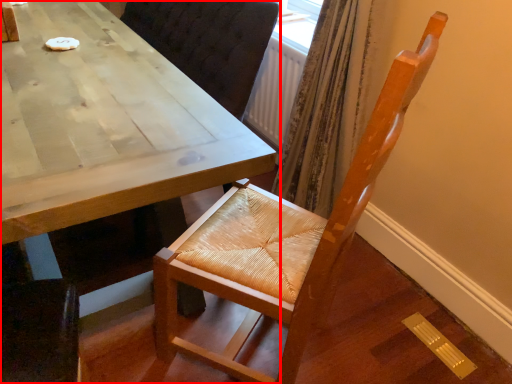
Question: From the image's perspective, what is the correct spatial positioning of table (annotated by the red box) in reference to chair?

Choices:
 (A) above
 (B) below

Answer: (A)